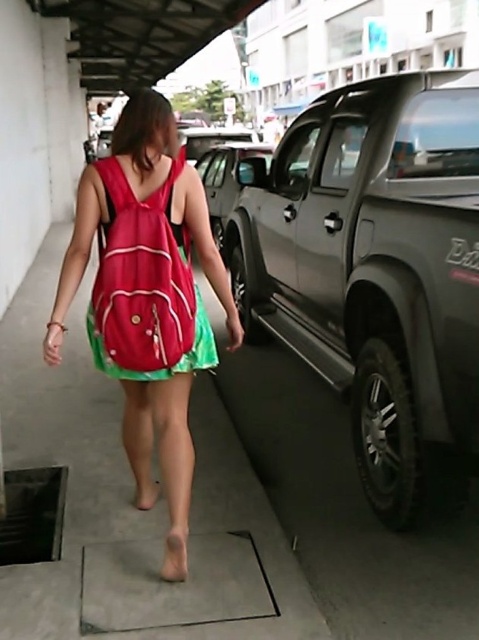
Which is more to the left, green satin dress at center or brown leather sandal at lower center?

Positioned to the left is green satin dress at center.

Is point (169, 362) positioned after point (168, 566)?

No, it is in front of (168, 566).

The height and width of the screenshot is (640, 479). In order to click on green satin dress at center in this screenshot , I will do `click(146, 288)`.

Who is more forward, [168,541] or [151,481]?

Point [168,541] is more forward.

Does brown leather sandal at lower center have a lesser width compared to nude leather sandal at lower center?

Indeed, brown leather sandal at lower center has a lesser width compared to nude leather sandal at lower center.

Which is in front, point (185, 566) or point (151, 488)?

Point (185, 566)

Where is `brown leather sandal at lower center`? brown leather sandal at lower center is located at coordinates (174, 556).

Who is taller, green fabric pavement at center or brown leather sandal at lower center?

Standing taller between the two is green fabric pavement at center.

What do you see at coordinates (130, 499) in the screenshot? I see `green fabric pavement at center` at bounding box center [130, 499].

The height and width of the screenshot is (640, 479). I want to click on green fabric pavement at center, so click(130, 499).